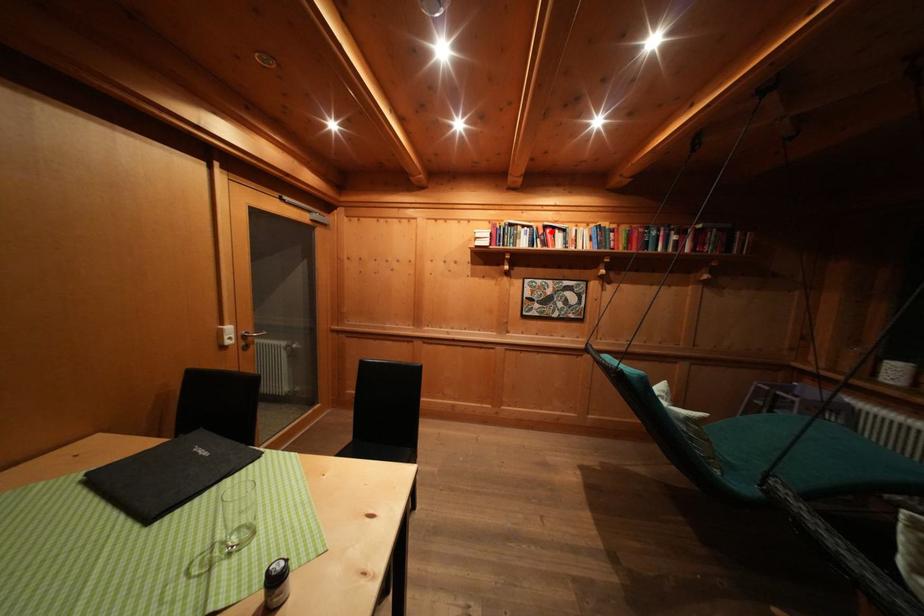
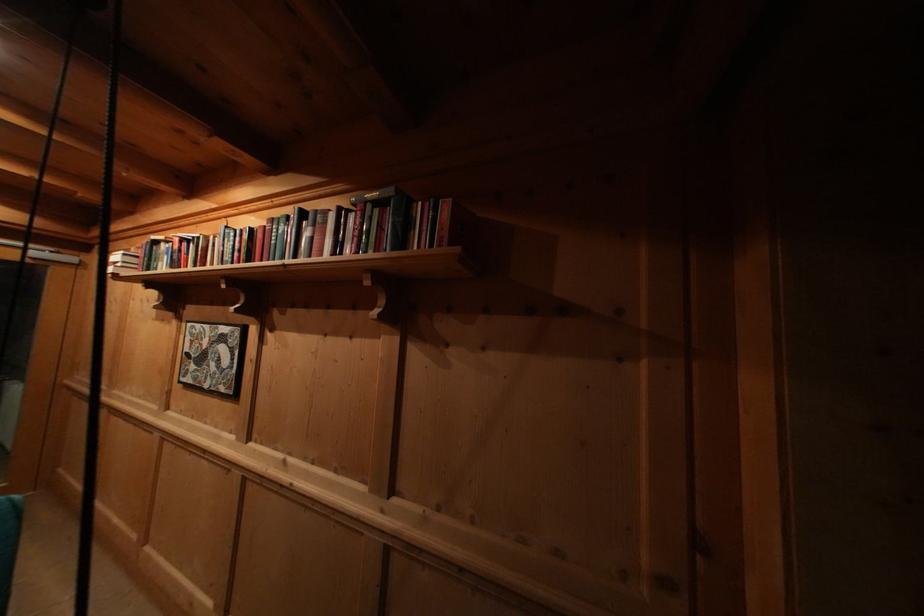
Where in the second image is the point corresponding to the highlighted location from the first image?

(188, 246)